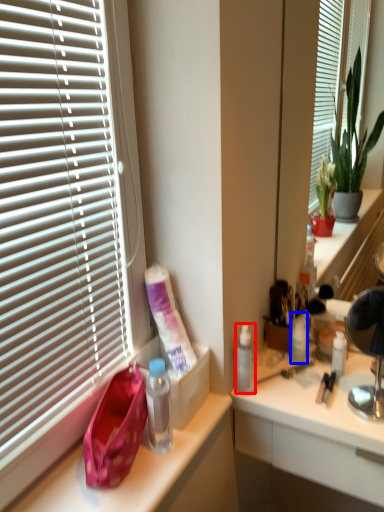
Question: Which of the following is the closest to the observer, bottle (highlighted by a red box) or toiletry (highlighted by a blue box)?

Choices:
 (A) bottle
 (B) toiletry

Answer: (A)